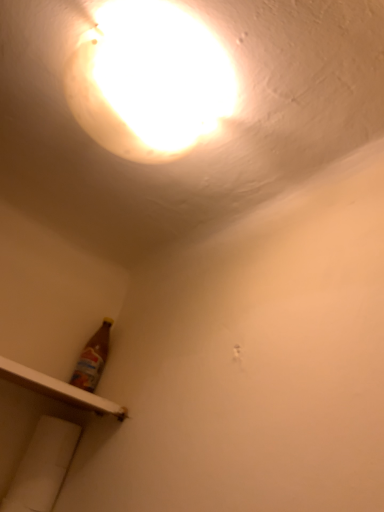
Question: Considering the positions of matte white light at upper center and white plastic shelf at lower left in the image, is matte white light at upper center taller or shorter than white plastic shelf at lower left?

Choices:
 (A) tall
 (B) short

Answer: (A)

Question: Relative to white plastic shelf at lower left, is matte white light at upper center in front or behind?

Choices:
 (A) behind
 (B) front

Answer: (B)

Question: Does point (112, 95) appear closer or farther from the camera than point (59, 389)?

Choices:
 (A) farther
 (B) closer

Answer: (B)

Question: Considering the positions of white plastic shelf at lower left and matte white light at upper center in the image, is white plastic shelf at lower left bigger or smaller than matte white light at upper center?

Choices:
 (A) small
 (B) big

Answer: (A)

Question: Is white plastic shelf at lower left inside the boundaries of matte white light at upper center, or outside?

Choices:
 (A) inside
 (B) outside

Answer: (B)

Question: Relative to matte white light at upper center, is white plastic shelf at lower left in front or behind?

Choices:
 (A) behind
 (B) front

Answer: (A)

Question: From the image's perspective, is white plastic shelf at lower left positioned above or below matte white light at upper center?

Choices:
 (A) below
 (B) above

Answer: (A)